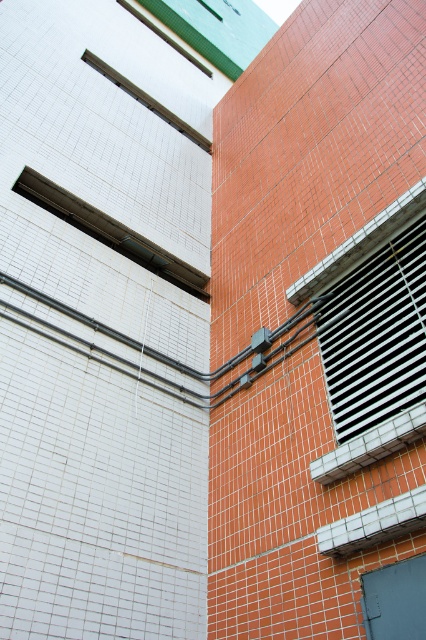
You are an architect reviewing the building facade. You need to determine which window is narrower between the black metal window at right and the matte glass window at upper left. Which one is narrower?

The black metal window at right is thinner than the matte glass window at upper left, so the black metal window at right is narrower.

You are standing in front of the two building facades. You notice a point marked at coordinates (377, 336). Which object from the list contains this point? Choose between the white tiled wall on the left and the black metal window at right.

The point at coordinates (377, 336) is located on the black metal window at right.

You are standing in front of two adjacent buildings. You notice a matte glass window at upper left and a matte glass window at upper center. Which window is located lower in the scene?

The matte glass window at upper left is positioned under the matte glass window at upper center, so it is located lower in the scene.